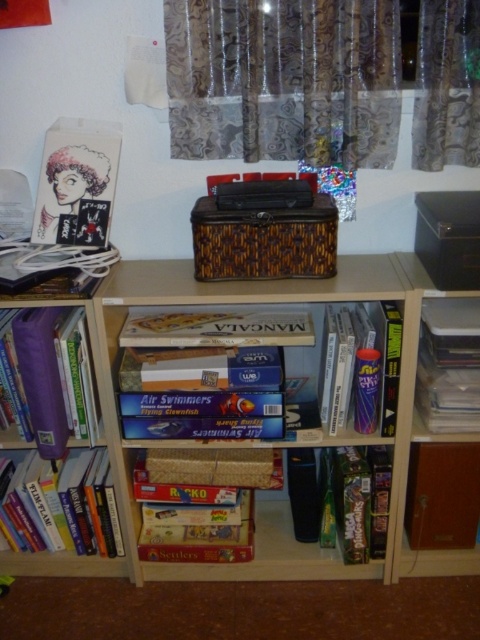
Question: Which point appears closest to the camera in this image?

Choices:
 (A) (471, 420)
 (B) (108, 531)
 (C) (145, 330)

Answer: (A)

Question: Is wooden bookcase at center above hardcover book at lower left?

Choices:
 (A) no
 (B) yes

Answer: (B)

Question: Estimate the real-world distances between objects in this image. Which object is closer to the matte purple book at center?

Choices:
 (A) hardcover book at lower left
 (B) matte cardboard board game at center

Answer: (B)

Question: In this image, where is textured fabric curtain at upper center located relative to matte cardboard book at center?

Choices:
 (A) right
 (B) left

Answer: (A)

Question: Which point is closer to the camera?

Choices:
 (A) (435, 83)
 (B) (225, 344)
 (C) (448, 573)

Answer: (A)

Question: Does hardcover book at lower left appear on the right side of matte cardboard board game at center?

Choices:
 (A) yes
 (B) no

Answer: (B)